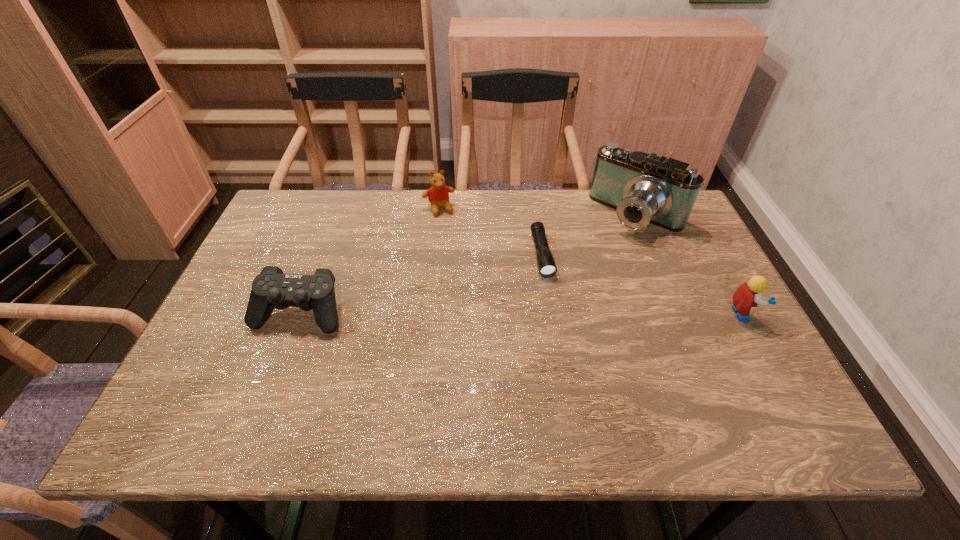
Where is `control`? control is located at coordinates (271, 288).

Find the location of a particular element. the leftmost object is located at coordinates (271, 288).

This screenshot has height=540, width=960. I want to click on Lego, so pos(748,295).

Where is `flashlight`? This screenshot has width=960, height=540. flashlight is located at coordinates (547, 268).

At what (x,y) coordinates should I click in order to perform the action: click on the shortest object. Please return your answer as a coordinate pair (x, y). Looking at the image, I should click on (547, 268).

Identify the location of teddy bear. The width and height of the screenshot is (960, 540). (438, 194).

Identify the location of camcorder. Image resolution: width=960 pixels, height=540 pixels. (643, 188).

At what (x,y) coordinates should I click in order to perform the action: click on free space located 0.260m on the right of the leftmost object. Please return your answer as a coordinate pair (x, y). Looking at the image, I should click on (452, 313).

Locate an element on the screen. Image resolution: width=960 pixels, height=540 pixels. free point located 0.180m at the lens end of the third object from left to right is located at coordinates (560, 333).

Image resolution: width=960 pixels, height=540 pixels. In order to click on vacant space located at the lens end of the third object from left to right in this screenshot , I will do `click(554, 310)`.